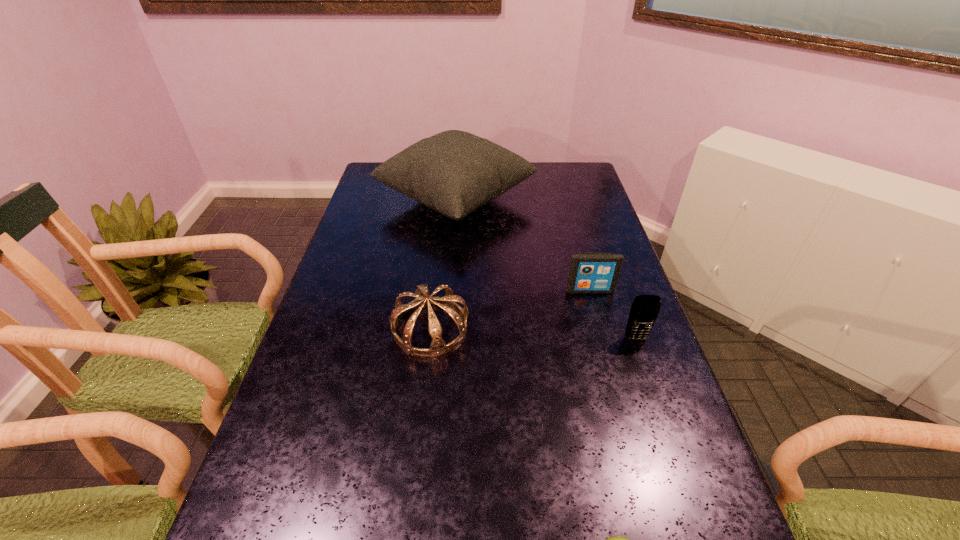
What are the coordinates of `object that ranks as the second closest to the tiara` in the screenshot? It's located at [x=589, y=272].

What are the coordinates of `the second closest object to the cushion` in the screenshot? It's located at (438, 346).